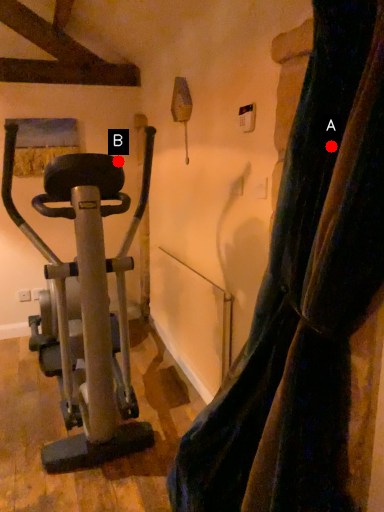
Question: Two points are circled on the image, labeled by A and B beside each circle. Which point appears closest to the camera in this image?

Choices:
 (A) A is closer
 (B) B is closer

Answer: (A)